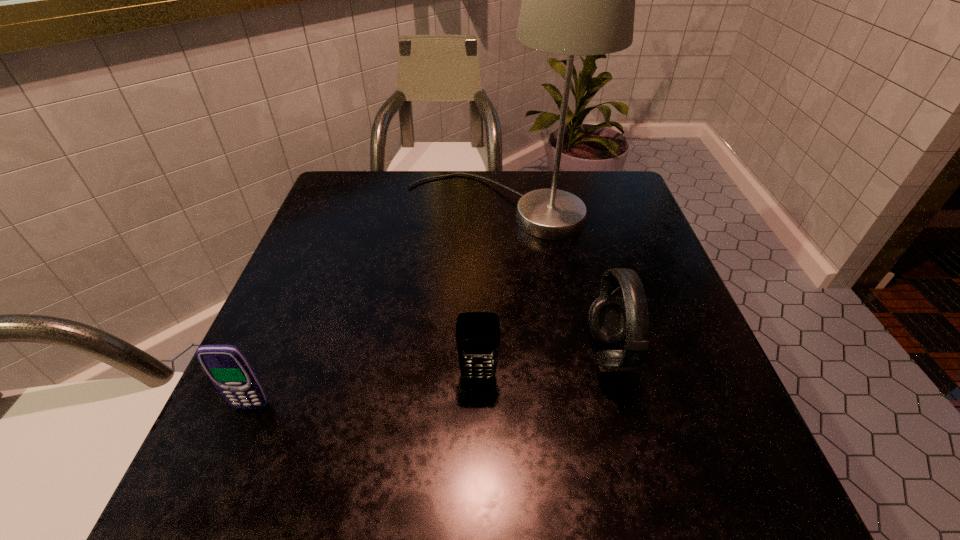
The height and width of the screenshot is (540, 960). Find the location of `empty location between the farthest object and the leftmost object`. empty location between the farthest object and the leftmost object is located at coordinates (374, 307).

This screenshot has width=960, height=540. What are the coordinates of `the second closest object to the leftmost object` in the screenshot? It's located at (579, 0).

You are a GUI agent. You are given a task and a screenshot of the screen. Output one action in this format:
    pyautogui.click(x=<x>, y=<y>)
    Task: Click on the object that ranks as the closest to the right cellular telephone
    The height and width of the screenshot is (540, 960).
    Given the screenshot: What is the action you would take?
    pyautogui.click(x=613, y=320)

Locate an element on the screen. The width and height of the screenshot is (960, 540). free space in the image that satisfies the following two spatial constraints: 1. on the earcups of the headset; 2. on the front-facing side of the left cellular telephone is located at coordinates (623, 406).

Locate an element on the screen. The width and height of the screenshot is (960, 540). vacant space that satisfies the following two spatial constraints: 1. on the earcups of the headset; 2. on the front-facing side of the nearest object is located at coordinates (623, 406).

I want to click on blank area in the image that satisfies the following two spatial constraints: 1. on the earcups of the headset; 2. on the screen of the farther cellular telephone, so click(615, 377).